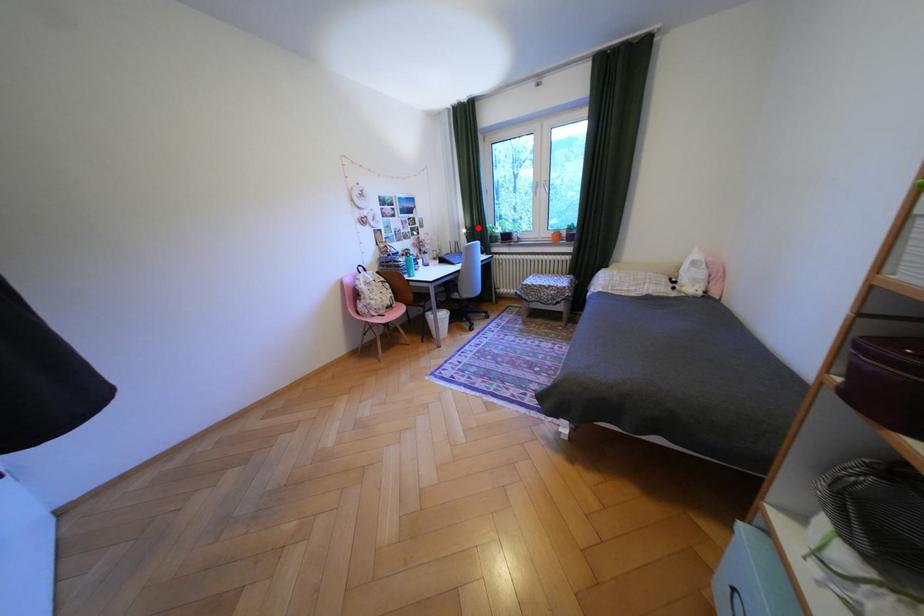
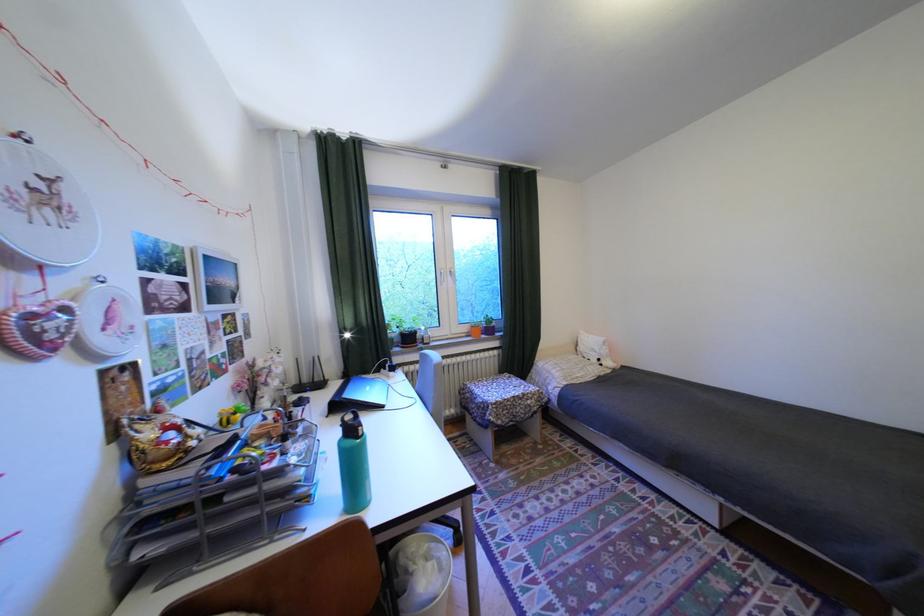
The point at the highlighted location is marked in the first image. Where is the corresponding point in the second image?

(354, 330)